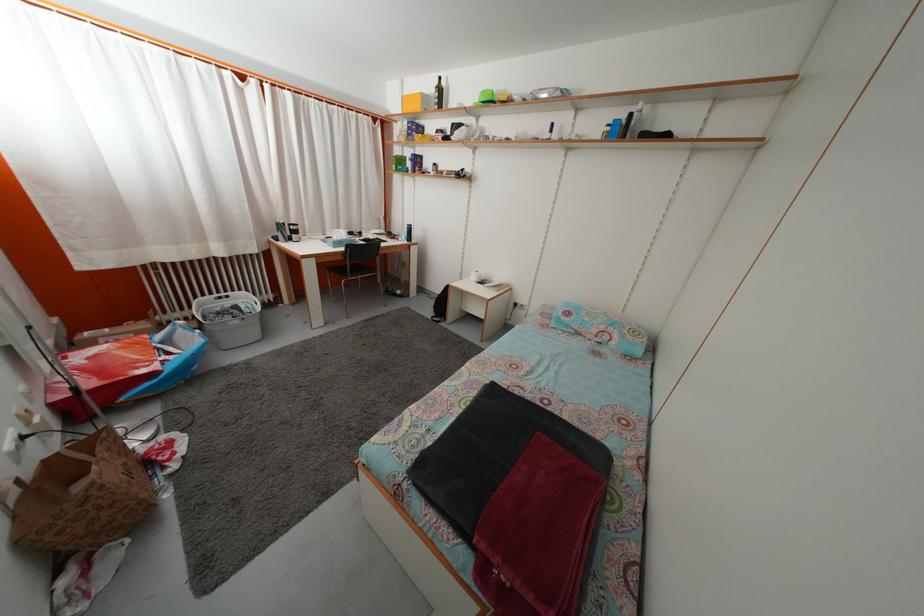
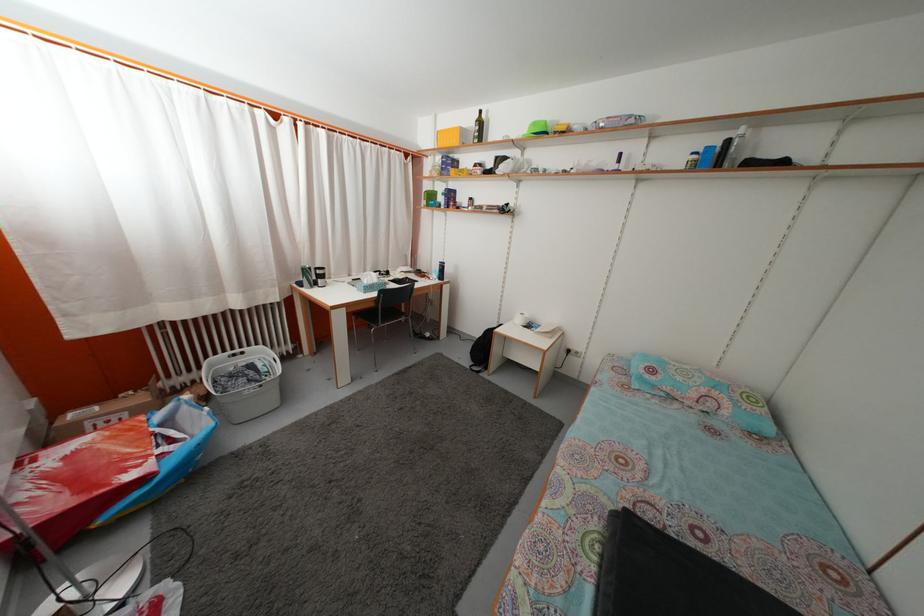
In the second image, find the point that corresponds to point 444,297 in the first image.

(482, 342)